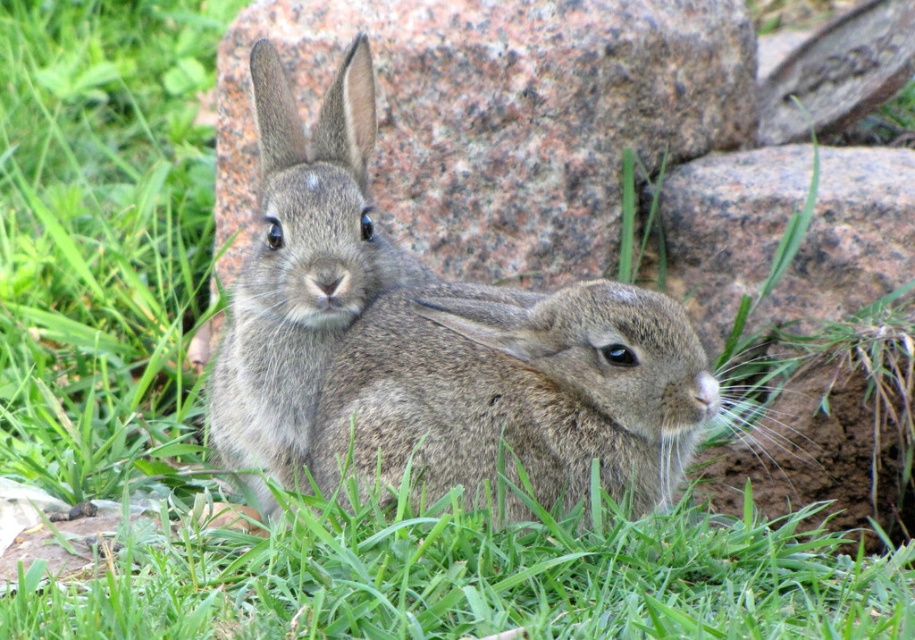
Does fuzzy brown rabbit at center lie in front of fuzzy gray rabbit at center?

Yes, fuzzy brown rabbit at center is closer to the viewer.

Who is positioned more to the left, fuzzy brown rabbit at center or fuzzy gray rabbit at center?

fuzzy gray rabbit at center is more to the left.

This screenshot has width=915, height=640. What do you see at coordinates (515, 397) in the screenshot?
I see `fuzzy brown rabbit at center` at bounding box center [515, 397].

I want to click on fuzzy brown rabbit at center, so click(515, 397).